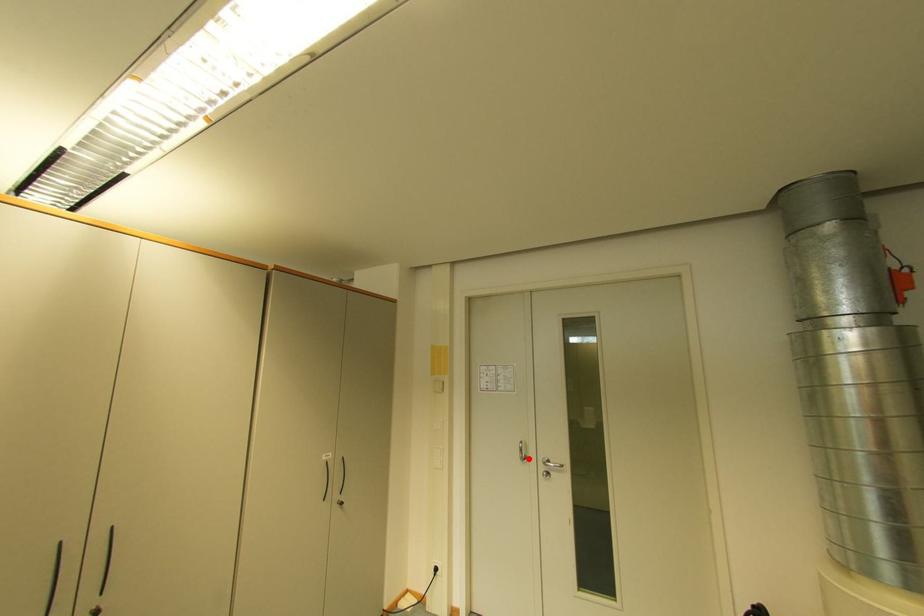
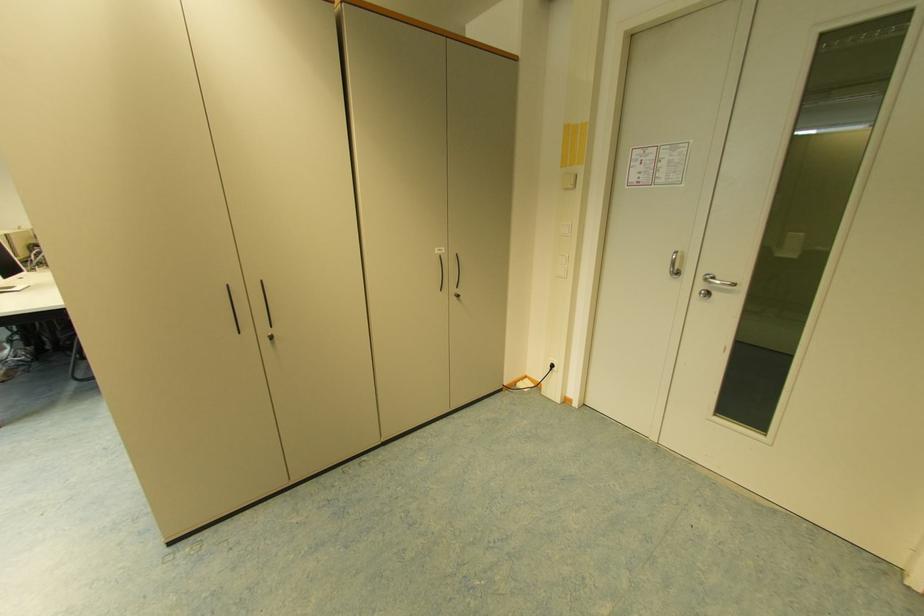
Locate, in the second image, the point that corresponds to the highlighted location in the first image.

(681, 274)